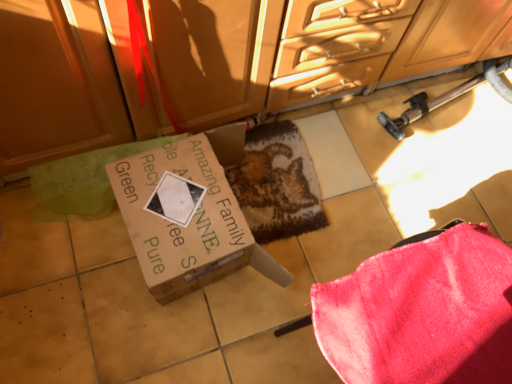
I want to click on matte wood cabinetry at upper center, so click(312, 44).

Where is `velvety pink blanket at lower right`? The height and width of the screenshot is (384, 512). velvety pink blanket at lower right is located at coordinates (422, 313).

Locate an element on the screen. This screenshot has width=512, height=384. textured brown mat at center is located at coordinates (277, 183).

The width and height of the screenshot is (512, 384). What are the coordinates of `matte wood cabinetry at upper center` in the screenshot? It's located at (312, 44).

How different are the orientations of textured brown mat at center and velvety pink blanket at lower right in degrees?

160 degrees separate the facing orientations of textured brown mat at center and velvety pink blanket at lower right.

Would you say textured brown mat at center is to the left or to the right of velvety pink blanket at lower right in the picture?

textured brown mat at center is positioned on velvety pink blanket at lower right's left side.

Considering the relative sizes of textured brown mat at center and velvety pink blanket at lower right in the image provided, is textured brown mat at center shorter than velvety pink blanket at lower right?

Yes, textured brown mat at center is shorter than velvety pink blanket at lower right.

From a real-world perspective, between textured brown mat at center and velvety pink blanket at lower right, who is vertically higher?

From a 3D spatial view, velvety pink blanket at lower right is above.

From the image's perspective, is brown cardboard box at center located above or below matte wood cabinetry at upper center?

From the image's perspective, brown cardboard box at center appears below matte wood cabinetry at upper center.

Is brown cardboard box at center placed right next to matte wood cabinetry at upper center?

No.

Which is in front, point (41, 81) or point (435, 317)?

Point (435, 317)

From a real-world perspective, is matte wood cabinetry at upper center positioned above or below velvety pink blanket at lower right?

matte wood cabinetry at upper center is above velvety pink blanket at lower right.

Can velvety pink blanket at lower right be found inside matte wood cabinetry at upper center?

No, velvety pink blanket at lower right is located outside of matte wood cabinetry at upper center.

Is brown cardboard box at center facing away from textured brown mat at center?

No, textured brown mat at center is not at the back of brown cardboard box at center.

Is brown cardboard box at center not inside textured brown mat at center?

Absolutely, brown cardboard box at center is external to textured brown mat at center.

Considering the relative sizes of brown cardboard box at center and textured brown mat at center in the image provided, is brown cardboard box at center wider than textured brown mat at center?

No, brown cardboard box at center is not wider than textured brown mat at center.

Is brown cardboard box at center directly adjacent to textured brown mat at center?

No, brown cardboard box at center is not beside textured brown mat at center.

Based on the photo, is the depth of velvety pink blanket at lower right greater than that of textured brown mat at center?

No, velvety pink blanket at lower right is in front of textured brown mat at center.

Is velvety pink blanket at lower right at the left side of textured brown mat at center?

No.

From a real-world perspective, is velvety pink blanket at lower right over textured brown mat at center?

Yes, from a real-world perspective, velvety pink blanket at lower right is above textured brown mat at center.

Is textured brown mat at center not near matte wood cabinetry at upper center?

No, textured brown mat at center is in close proximity to matte wood cabinetry at upper center.

Which is more to the right, textured brown mat at center or matte wood cabinetry at upper center?

Positioned to the right is matte wood cabinetry at upper center.

Can you confirm if textured brown mat at center is shorter than matte wood cabinetry at upper center?

Correct, textured brown mat at center is not as tall as matte wood cabinetry at upper center.

Locate an element on the screen. This screenshot has width=512, height=384. box on the left of matte wood cabinetry at upper center is located at coordinates (185, 219).

In the scene shown: From the image's perspective, which one is positioned lower, matte wood cabinetry at upper center or brown cardboard box at center?

brown cardboard box at center.

Considering the sizes of objects matte wood cabinetry at upper center and brown cardboard box at center in the image provided, who is bigger, matte wood cabinetry at upper center or brown cardboard box at center?

With larger size is matte wood cabinetry at upper center.

Is matte wood cabinetry at upper center inside or outside of brown cardboard box at center?

matte wood cabinetry at upper center is located beyond the bounds of brown cardboard box at center.

Where is `blanket in front of the textured brown mat at center`? The width and height of the screenshot is (512, 384). blanket in front of the textured brown mat at center is located at coordinates tap(422, 313).

Identify the location of box on the left of matte wood cabinetry at upper center. (185, 219).

Considering their positions, is velvety pink blanket at lower right positioned further to matte wood cabinetry at upper center than brown cardboard box at center?

velvety pink blanket at lower right lies further to matte wood cabinetry at upper center than the other object.

Which object lies further to the anchor point velvety pink blanket at lower right, textured brown mat at center or brown cardboard box at center?

Among the two, textured brown mat at center is located further to velvety pink blanket at lower right.

Looking at the image, which one is located closer to textured brown mat at center, matte wood cabinetry at upper center or velvety pink blanket at lower right?

The object closer to textured brown mat at center is matte wood cabinetry at upper center.

From the image, which object appears to be nearer to velvety pink blanket at lower right, matte wood cabinetry at upper center or textured brown mat at center?

textured brown mat at center lies closer to velvety pink blanket at lower right than the other object.

Estimate the real-world distances between objects in this image. Which object is closer to matte wood cabinetry at upper center, velvety pink blanket at lower right or textured brown mat at center?

The object closer to matte wood cabinetry at upper center is textured brown mat at center.

From the picture: Considering their positions, is velvety pink blanket at lower right positioned closer to brown cardboard box at center than textured brown mat at center?

textured brown mat at center is closer to brown cardboard box at center.

Based on their spatial positions, is matte wood cabinetry at upper center or textured brown mat at center closer to brown cardboard box at center?

textured brown mat at center.

Looking at the image, which one is located closer to textured brown mat at center, brown cardboard box at center or matte wood cabinetry at upper center?

Based on the image, brown cardboard box at center appears to be nearer to textured brown mat at center.

What are the coordinates of `box located between velvety pink blanket at lower right and textured brown mat at center in the depth direction` in the screenshot? It's located at (185, 219).

Locate an element on the screen. This screenshot has width=512, height=384. cabinetry between velvety pink blanket at lower right and textured brown mat at center along the z-axis is located at coordinates (312, 44).

The width and height of the screenshot is (512, 384). I want to click on mat between matte wood cabinetry at upper center and brown cardboard box at center in the up-down direction, so click(x=277, y=183).

You are a GUI agent. You are given a task and a screenshot of the screen. Output one action in this format:
    pyautogui.click(x=<x>, y=<y>)
    Task: Click on the box between matte wood cabinetry at upper center and velvety pink blanket at lower right in the vertical direction
    The height and width of the screenshot is (384, 512).
    Given the screenshot: What is the action you would take?
    (x=185, y=219)